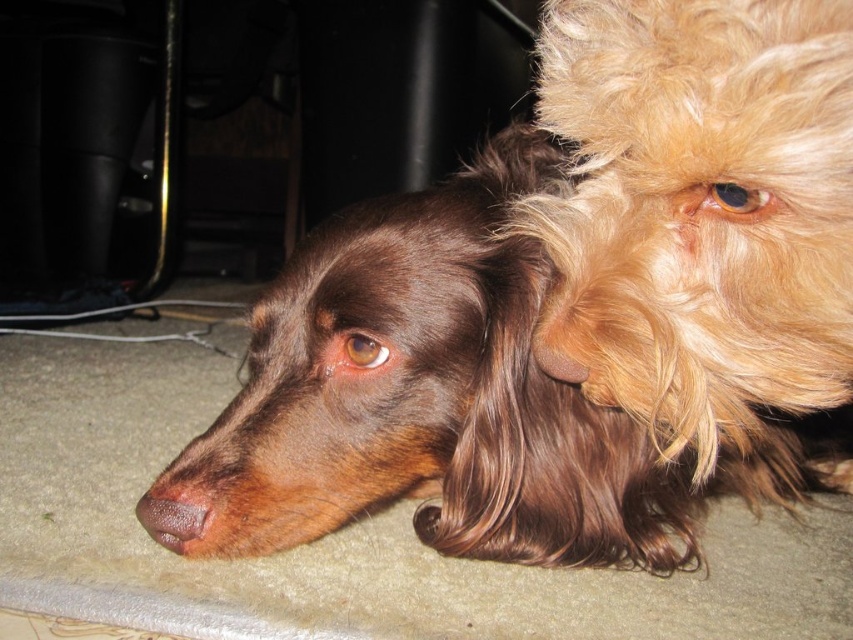
In the scene shown: Is brown shiny fur dog at center wider than brown matte nose at lower left?

Yes, brown shiny fur dog at center is wider than brown matte nose at lower left.

Is point (766, 467) positioned in front of point (167, 534)?

No, it is not.

The image size is (853, 640). What do you see at coordinates (450, 397) in the screenshot? I see `brown shiny fur dog at center` at bounding box center [450, 397].

Identify the location of brown shiny fur dog at center. This screenshot has height=640, width=853. (450, 397).